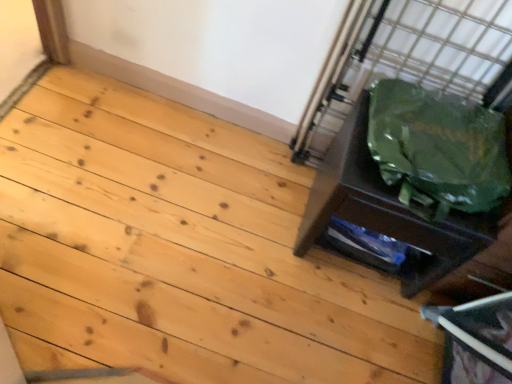
Question: Is green fabric bag at right in front of or behind natural wood floor at lower right in the image?

Choices:
 (A) behind
 (B) front

Answer: (A)

Question: Choose the correct answer: Is green fabric bag at right inside natural wood floor at lower right or outside it?

Choices:
 (A) outside
 (B) inside

Answer: (A)

Question: Which object is positioned closest to the green fabric bag at right?

Choices:
 (A) green plastic bag at right
 (B) natural wood floor at lower right

Answer: (A)

Question: Which is farther from the natural wood floor at lower right?

Choices:
 (A) green plastic bag at right
 (B) green fabric bag at right

Answer: (A)